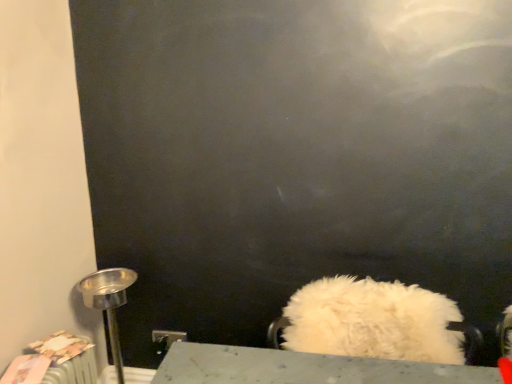
Question: From the image's perspective, is metallic silver table lamp at left on top of white fluffy cushion at lower center?

Choices:
 (A) no
 (B) yes

Answer: (A)

Question: Is metallic silver table lamp at left touching white fluffy cushion at lower center?

Choices:
 (A) yes
 (B) no

Answer: (B)

Question: Is metallic silver table lamp at left looking in the opposite direction of white fluffy cushion at lower center?

Choices:
 (A) yes
 (B) no

Answer: (B)

Question: Does metallic silver table lamp at left have a greater height compared to white fluffy cushion at lower center?

Choices:
 (A) no
 (B) yes

Answer: (B)

Question: Are metallic silver table lamp at left and white fluffy cushion at lower center far apart?

Choices:
 (A) no
 (B) yes

Answer: (A)

Question: Considering the relative sizes of metallic silver table lamp at left and white fluffy cushion at lower center in the image provided, is metallic silver table lamp at left wider than white fluffy cushion at lower center?

Choices:
 (A) no
 (B) yes

Answer: (A)

Question: Can you confirm if white fluffy cushion at lower center is taller than metallic silver table lamp at left?

Choices:
 (A) no
 (B) yes

Answer: (A)

Question: Could you tell me if white fluffy cushion at lower center is turned towards metallic silver table lamp at left?

Choices:
 (A) no
 (B) yes

Answer: (A)

Question: Is white fluffy cushion at lower center at the right side of metallic silver table lamp at left?

Choices:
 (A) yes
 (B) no

Answer: (A)

Question: From the image's perspective, is white fluffy cushion at lower center under metallic silver table lamp at left?

Choices:
 (A) yes
 (B) no

Answer: (B)

Question: From a real-world perspective, does white fluffy cushion at lower center sit lower than metallic silver table lamp at left?

Choices:
 (A) no
 (B) yes

Answer: (A)

Question: Is white fluffy cushion at lower center behind metallic silver table lamp at left?

Choices:
 (A) no
 (B) yes

Answer: (A)

Question: Visually, is metallic silver table lamp at left positioned to the left or to the right of white fluffy cushion at lower center?

Choices:
 (A) right
 (B) left

Answer: (B)